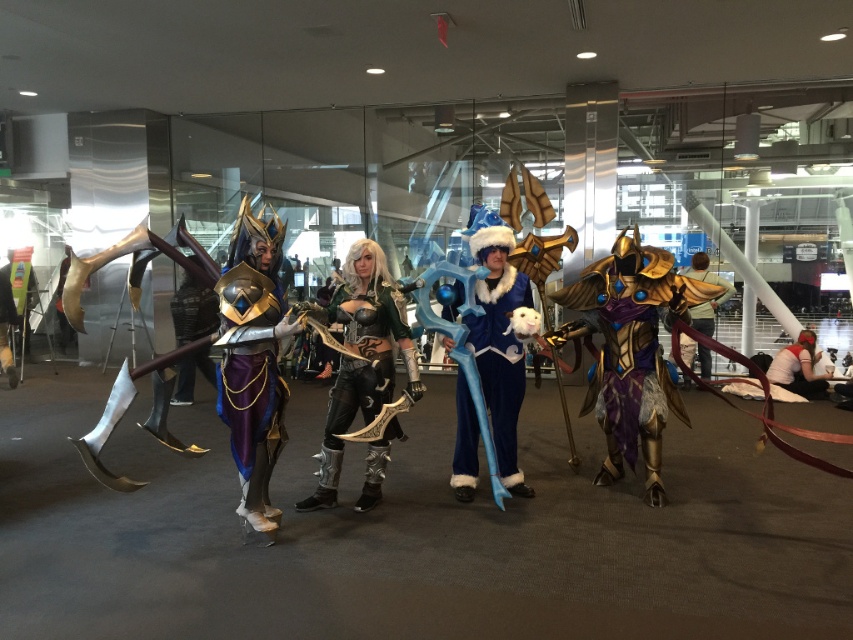
You are a photographer at the convention and need to position the two cosplayers with metallic purple armor at center and green metallic armor at center for a group photo. Based on their current positions, which one should you move to the right to ensure they are side by side?

The metallic purple armor at center is to the left of green metallic armor at center, so you should move the green metallic armor at center to the right to align them side by side.

You are a photographer at a cosplay event. You need to capture a photo that includes both the black leather armor at center and the white fabric shirt at lower right. Based on their positions, which object should you focus on first to ensure both are in frame?

The black leather armor at center is in front of the white fabric shirt at lower right, so you should focus on the black leather armor at center first to ensure both are in frame.

You are a photographer at the convention center and want to capture a photo where both the white fabric shirt at lower right and the gold metallic armor at center are visible. Given their height difference, where should you position your camera to ensure both are fully visible in the frame?

Position the camera at a lower angle to capture the full height of the gold metallic armor at center while still including the white fabric shirt at lower right, which is shorter. This angle will ensure both objects are visible without cropping either.